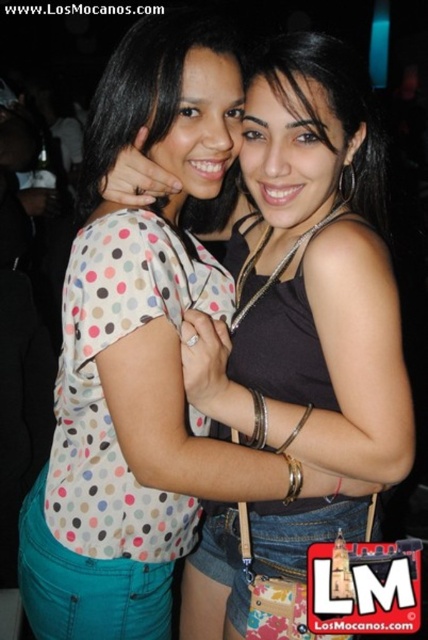
Does matte black tank top at center appear over polka dot shirt at center?

No.

Does matte black tank top at center have a greater height compared to polka dot shirt at center?

Indeed, matte black tank top at center has a greater height compared to polka dot shirt at center.

You are a GUI agent. You are given a task and a screenshot of the screen. Output one action in this format:
    pyautogui.click(x=<x>, y=<y>)
    Task: Click on the matte black tank top at center
    The width and height of the screenshot is (428, 640).
    Given the screenshot: What is the action you would take?
    pyautogui.click(x=309, y=276)

I want to click on matte black tank top at center, so click(x=309, y=276).

Is matte black tank top at center above polka dot fabric shirt at center?

No, matte black tank top at center is not above polka dot fabric shirt at center.

Does point (332, 436) lie behind point (97, 317)?

Yes, it is.

In order to click on matte black tank top at center in this screenshot , I will do `click(309, 276)`.

What do you see at coordinates (109, 442) in the screenshot? The image size is (428, 640). I see `polka dot fabric shirt at center` at bounding box center [109, 442].

Which is more to the right, polka dot fabric shirt at center or polka dot shirt at center?

polka dot shirt at center is more to the right.

You are a GUI agent. You are given a task and a screenshot of the screen. Output one action in this format:
    pyautogui.click(x=<x>, y=<y>)
    Task: Click on the polka dot fabric shirt at center
    
    Given the screenshot: What is the action you would take?
    pyautogui.click(x=109, y=442)